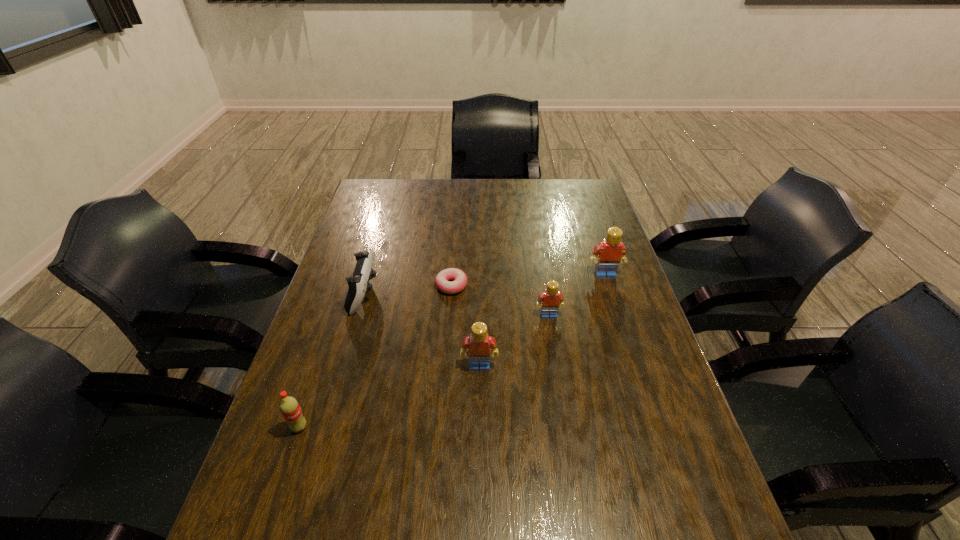
Locate an element on the screen. Image resolution: width=960 pixels, height=540 pixels. free space at the near edge of the desktop is located at coordinates (423, 482).

In the image, there is a desktop. Where is `vacant space at the left edge`? vacant space at the left edge is located at coordinates (345, 404).

I want to click on vacant area at the right edge, so click(x=575, y=228).

Locate an element on the screen. This screenshot has width=960, height=540. free space at the near right corner of the desktop is located at coordinates (664, 507).

In order to click on free spot between the nearest Lego and the fifth object from right to left in this screenshot , I will do `click(421, 330)`.

This screenshot has height=540, width=960. What are the coordinates of `free space that is in between the leftmost Lego and the leftmost object` in the screenshot? It's located at (389, 397).

Where is `vacant area that lies between the leftmost object and the shortest object`? vacant area that lies between the leftmost object and the shortest object is located at coordinates (375, 356).

The height and width of the screenshot is (540, 960). I want to click on free space between the doughnut and the farthest Lego, so click(x=528, y=280).

Where is `vacant space in between the leftmost object and the doughnut`? This screenshot has height=540, width=960. vacant space in between the leftmost object and the doughnut is located at coordinates (375, 356).

Locate an element on the screen. Image resolution: width=960 pixels, height=540 pixels. unoccupied position between the shortest Lego and the control is located at coordinates (456, 305).